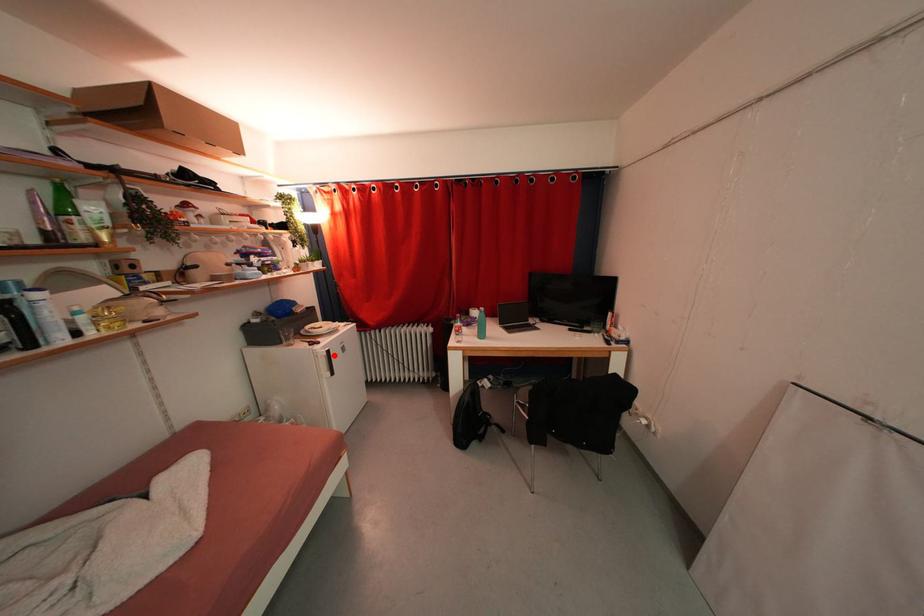
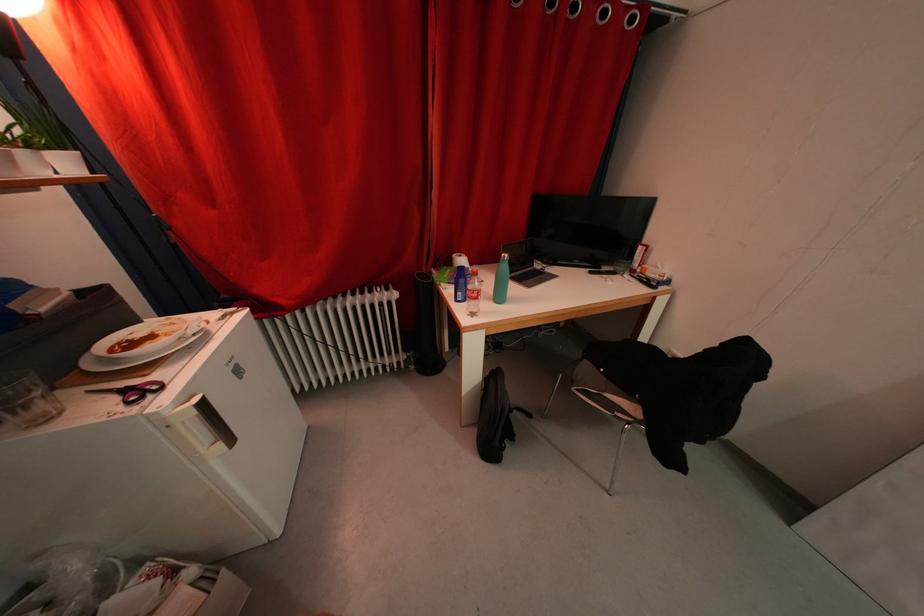
Question: I am providing you with two images of the same scene from different viewpoints. A red point is marked on the first image. At the location where the point appears in image 1, is it still visible in image 2?

Choices:
 (A) Yes
 (B) No

Answer: (A)